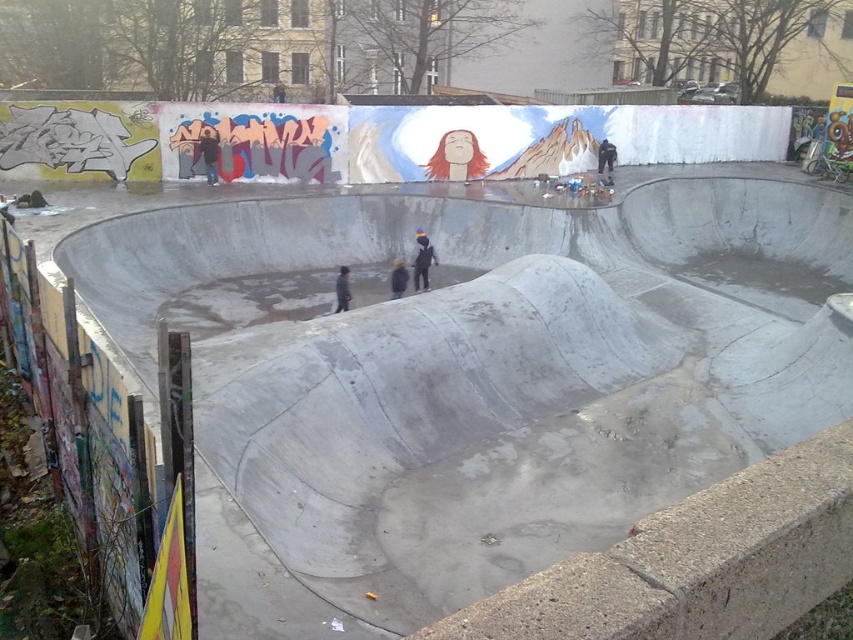
Question: Which point is farther to the camera?

Choices:
 (A) click(x=682, y=461)
 (B) click(x=207, y=177)

Answer: (B)

Question: Which point is farther from the camera taking this photo?

Choices:
 (A) (612, 152)
 (B) (335, 285)
 (C) (390, 282)

Answer: (A)

Question: Is dark blue jacket at upper left thinner than dark gray jacket at center?

Choices:
 (A) no
 (B) yes

Answer: (A)

Question: Is black matte jacket at center thinner than dark blue jacket at upper center?

Choices:
 (A) yes
 (B) no

Answer: (A)

Question: Can you confirm if black matte jacket at center is bigger than dark blue jacket at upper center?

Choices:
 (A) no
 (B) yes

Answer: (B)

Question: Which object is closer to the camera taking this photo?

Choices:
 (A) dark blue jacket at upper center
 (B) concrete skate park at center
 (C) dark gray jacket at center

Answer: (B)